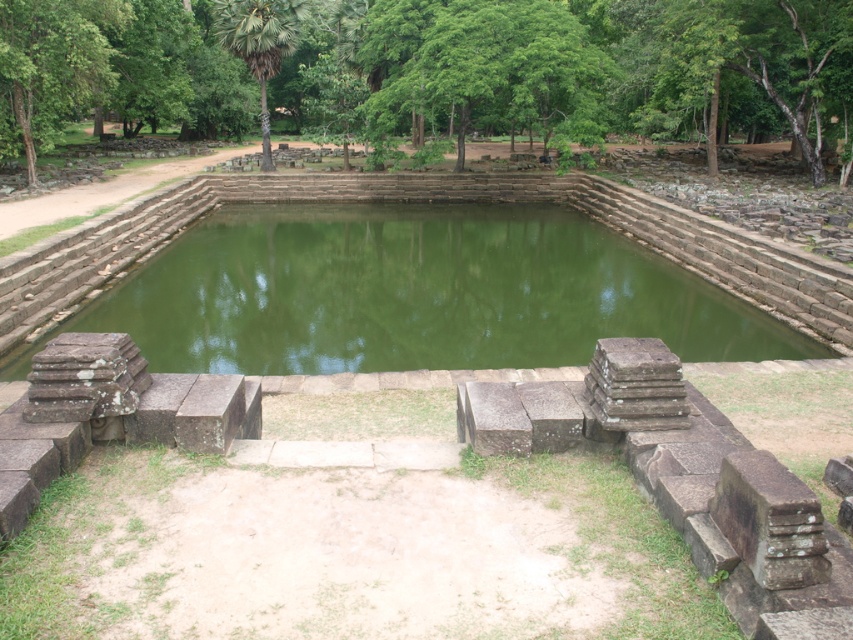
Question: Among these points, which one is farthest from the camera?

Choices:
 (A) (15, 134)
 (B) (231, 40)
 (C) (711, 324)

Answer: (B)

Question: Among these points, which one is farthest from the camera?

Choices:
 (A) (97, 3)
 (B) (692, 70)
 (C) (225, 38)
 (D) (311, 332)

Answer: (C)

Question: Is green leafy tree at center smaller than green leafy tree at upper left?

Choices:
 (A) yes
 (B) no

Answer: (B)

Question: Among these objects, which one is nearest to the camera?

Choices:
 (A) green stone lake at center
 (B) green leafy tree at center

Answer: (A)

Question: Can you confirm if green stone lake at center is bigger than green leafy palm tree at upper center?

Choices:
 (A) yes
 (B) no

Answer: (A)

Question: Can you confirm if green leafy tree at center is bigger than green leafy palm tree at upper center?

Choices:
 (A) no
 (B) yes

Answer: (B)